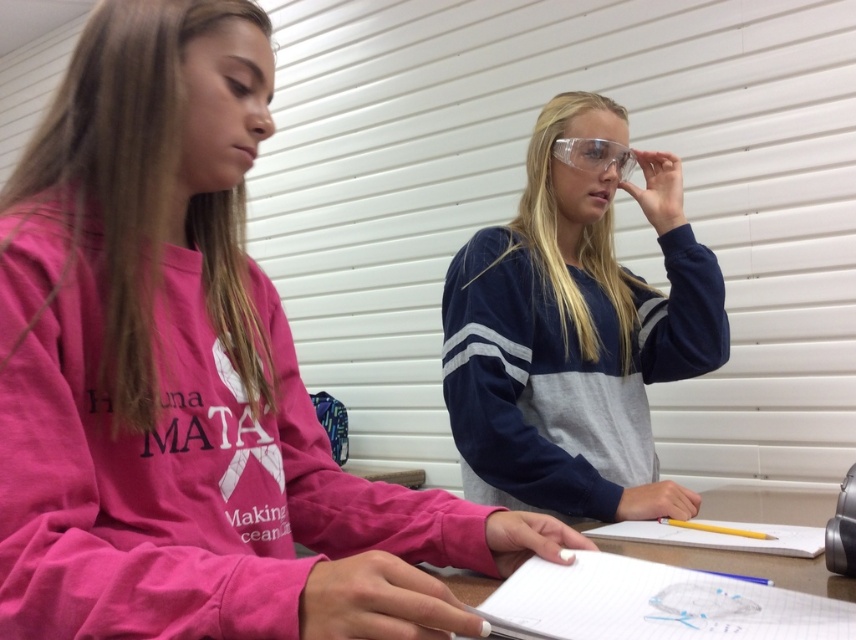
Question: Does white paper at center appear under clear plastic goggles at upper center?

Choices:
 (A) yes
 (B) no

Answer: (A)

Question: Which point is closer to the camera?

Choices:
 (A) pink sweatshirt at left
 (B) clear plastic goggles at upper center
 (C) white paper at center
 (D) yellow matte pencil at center

Answer: (A)

Question: Which point is closer to the camera?

Choices:
 (A) (634, 563)
 (B) (569, 221)
 (C) (9, 508)

Answer: (C)

Question: Can you confirm if clear plastic goggles at center is bigger than clear plastic goggles at upper center?

Choices:
 (A) yes
 (B) no

Answer: (A)

Question: Is white paper at center bigger than clear plastic goggles at upper center?

Choices:
 (A) yes
 (B) no

Answer: (A)

Question: Which of the following is the farthest from the observer?

Choices:
 (A) (x=615, y=157)
 (B) (x=627, y=186)
 (C) (x=654, y=524)

Answer: (B)